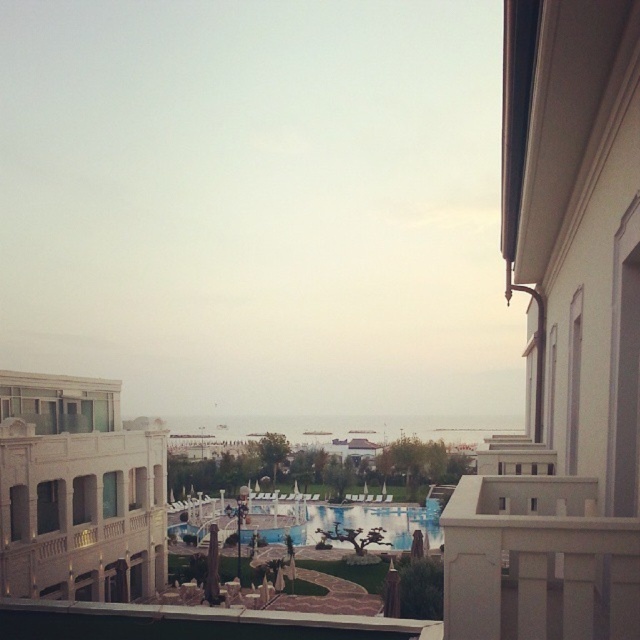
Question: Is white stone building at left further to the viewer compared to blue glossy pool at center?

Choices:
 (A) no
 (B) yes

Answer: (A)

Question: Which point is farther to the camera?

Choices:
 (A) (380, 508)
 (B) (612, 65)
 (C) (563, 544)
 (D) (106, 417)

Answer: (A)

Question: Considering the real-world distances, which object is farthest from the white smooth building at right?

Choices:
 (A) white concrete balustrade at upper right
 (B) blue glossy pool at center

Answer: (B)

Question: Is white smooth building at right wider than white concrete balustrade at upper right?

Choices:
 (A) yes
 (B) no

Answer: (A)

Question: Which point is closer to the camera?

Choices:
 (A) (387, 509)
 (B) (548, 616)

Answer: (B)

Question: Does white smooth building at right have a smaller size compared to white stone building at left?

Choices:
 (A) yes
 (B) no

Answer: (B)